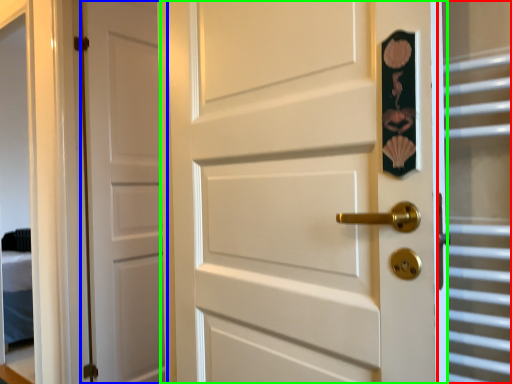
Question: Estimate the real-world distances between objects in this image. Which object is closer to glass door (highlighted by a red box), door (highlighted by a blue box) or door (highlighted by a green box)?

Choices:
 (A) door
 (B) door

Answer: (B)